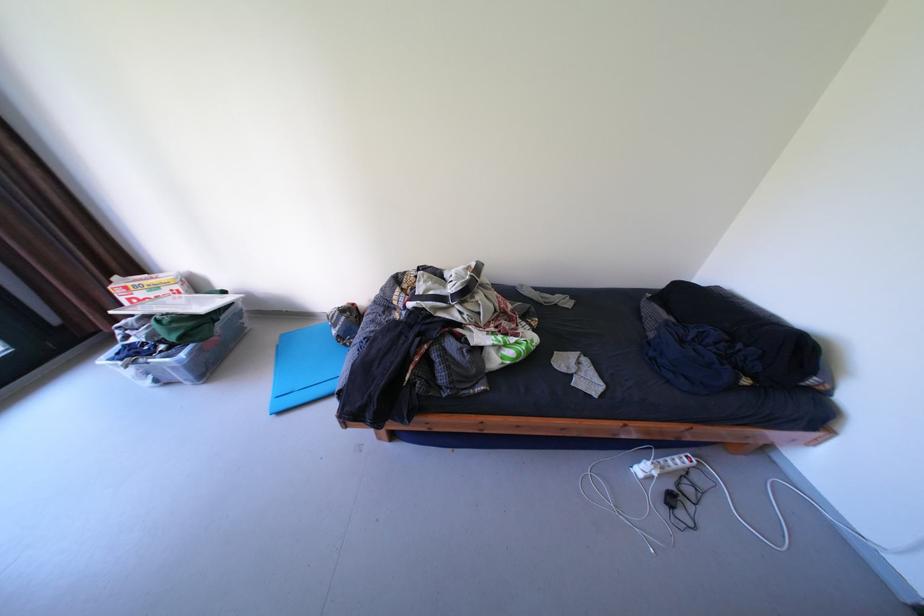
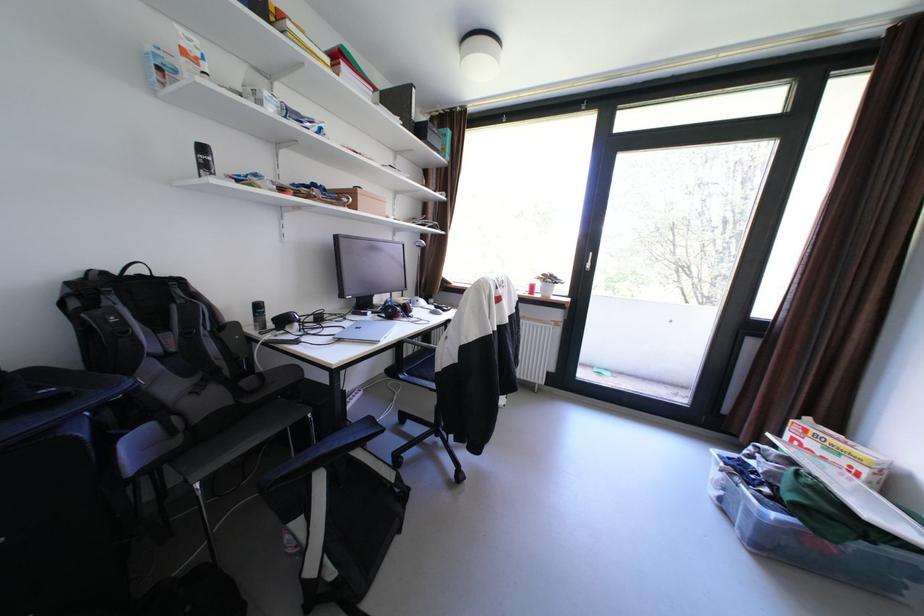
Where in the second image is the point corresponding to point (193, 355) from the first image?

(784, 516)